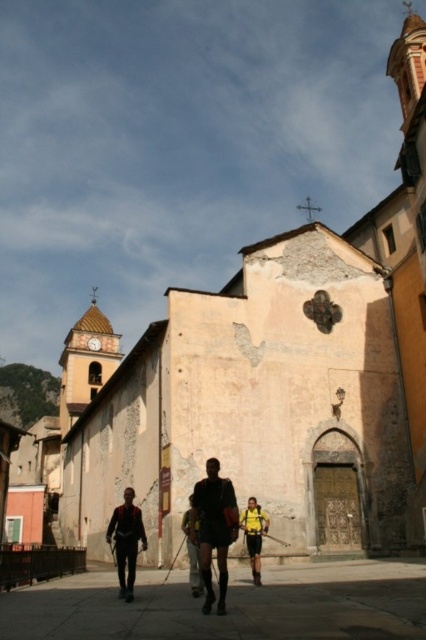
Which is more to the left, weathered stone church at center or yellow fabric backpack at center?

Positioned to the left is weathered stone church at center.

Which is below, weathered stone church at center or yellow fabric backpack at center?

yellow fabric backpack at center is lower down.

This screenshot has width=426, height=640. Identify the location of weathered stone church at center. (252, 403).

Who is higher up, matte black shorts at center or matte black backpack at center?

matte black shorts at center is higher up.

Which is more to the left, matte black shorts at center or matte black backpack at center?

From the viewer's perspective, matte black backpack at center appears more on the left side.

Between point (226, 577) and point (124, 552), which one is positioned in front?

Point (226, 577) is more forward.

You are a GUI agent. You are given a task and a screenshot of the screen. Output one action in this format:
    pyautogui.click(x=<x>, y=<y>)
    Task: Click on the matte black shorts at center
    This screenshot has height=640, width=426.
    Given the screenshot: What is the action you would take?
    pyautogui.click(x=213, y=529)

Can you confirm if matte black backpack at center is positioned below yellow fabric backpack at center?

Yes.

Is matte black backpack at center in front of yellow fabric backpack at center?

Yes, matte black backpack at center is closer to the viewer.

Does point (141, 538) come in front of point (256, 566)?

That is True.

This screenshot has width=426, height=640. In order to click on matte black backpack at center in this screenshot , I will do [x=126, y=541].